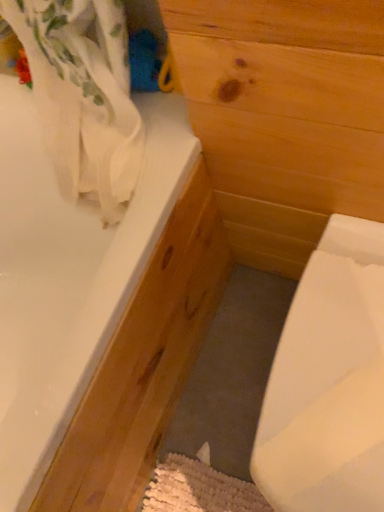
This screenshot has height=512, width=384. What do you see at coordinates (328, 381) in the screenshot? I see `white glossy sink at lower right` at bounding box center [328, 381].

Locate an element on the screen. The image size is (384, 512). white glossy sink at lower right is located at coordinates (328, 381).

What do you see at coordinates (98, 313) in the screenshot?
I see `white glossy bathtub at upper left` at bounding box center [98, 313].

Where is `white glossy bathtub at upper left`? This screenshot has width=384, height=512. white glossy bathtub at upper left is located at coordinates (98, 313).

Where is `white glossy sink at lower right`? white glossy sink at lower right is located at coordinates (328, 381).

Considering the positions of objects white glossy sink at lower right and white glossy bathtub at upper left in the image provided, who is more to the right, white glossy sink at lower right or white glossy bathtub at upper left?

Positioned to the right is white glossy sink at lower right.

Who is more distant, white glossy sink at lower right or white glossy bathtub at upper left?

white glossy sink at lower right.

Is point (323, 464) behind point (71, 346)?

No, it is in front of (71, 346).

From the image's perspective, does white glossy sink at lower right appear higher than white glossy bathtub at upper left?

No.

From a real-world perspective, between white glossy sink at lower right and white glossy bathtub at upper left, who is vertically higher?

In real-world perspective, white glossy bathtub at upper left is above.

Can you confirm if white glossy sink at lower right is wider than white glossy bathtub at upper left?

In fact, white glossy sink at lower right might be narrower than white glossy bathtub at upper left.

Which of these two, white glossy sink at lower right or white glossy bathtub at upper left, stands shorter?

white glossy sink at lower right is shorter.

Looking at the image, does white glossy sink at lower right seem bigger or smaller compared to white glossy bathtub at upper left?

Considering their sizes, white glossy sink at lower right takes up less space than white glossy bathtub at upper left.

Can white glossy bathtub at upper left be found inside white glossy sink at lower right?

No.

Is white glossy sink at lower right touching white glossy bathtub at upper left?

No, white glossy sink at lower right is not with white glossy bathtub at upper left.

Could you tell me if white glossy sink at lower right is turned towards white glossy bathtub at upper left?

No.

How different are the orientations of white glossy sink at lower right and white glossy bathtub at upper left in degrees?

white glossy sink at lower right and white glossy bathtub at upper left are facing 88.9 degrees away from each other.

Where is `bathtub to the left of white glossy sink at lower right`? The image size is (384, 512). bathtub to the left of white glossy sink at lower right is located at coordinates (98, 313).

Which object is positioned more to the right, white glossy bathtub at upper left or white glossy sink at lower right?

white glossy sink at lower right.

Relative to white glossy sink at lower right, is white glossy bathtub at upper left in front or behind?

In the image, white glossy bathtub at upper left appears in front of white glossy sink at lower right.

Which is nearer, (32, 383) or (352, 324)?

Point (32, 383) is farther from the camera than point (352, 324).

From the image's perspective, is white glossy bathtub at upper left on white glossy sink at lower right?

Yes, from the image's perspective, white glossy bathtub at upper left is over white glossy sink at lower right.

From a real-world perspective, is white glossy bathtub at upper left above or below white glossy sink at lower right?

From a real-world perspective, white glossy bathtub at upper left is physically above white glossy sink at lower right.

Is white glossy bathtub at upper left thinner than white glossy sink at lower right?

In fact, white glossy bathtub at upper left might be wider than white glossy sink at lower right.

Consider the image. Does white glossy bathtub at upper left have a greater height compared to white glossy sink at lower right?

Yes.

Is white glossy bathtub at upper left smaller than white glossy sink at lower right?

No, white glossy bathtub at upper left is not smaller than white glossy sink at lower right.

Is white glossy bathtub at upper left completely or partially outside of white glossy sink at lower right?

Indeed, white glossy bathtub at upper left is completely outside white glossy sink at lower right.

Are white glossy bathtub at upper left and white glossy sink at lower right beside each other?

No, white glossy bathtub at upper left is not making contact with white glossy sink at lower right.

Could you tell me if white glossy bathtub at upper left is turned towards white glossy sink at lower right?

Yes, white glossy bathtub at upper left is facing white glossy sink at lower right.

How many degrees apart are the facing directions of white glossy bathtub at upper left and white glossy sink at lower right?

The facing directions of white glossy bathtub at upper left and white glossy sink at lower right are 88.9 degrees apart.

Identify the location of sink located behind the white glossy bathtub at upper left. The image size is (384, 512). (328, 381).

This screenshot has width=384, height=512. I want to click on bathtub on the left of white glossy sink at lower right, so click(98, 313).

Where is `sink that is below the white glossy bathtub at upper left (from the image's perspective)`? The image size is (384, 512). sink that is below the white glossy bathtub at upper left (from the image's perspective) is located at coordinates (328, 381).